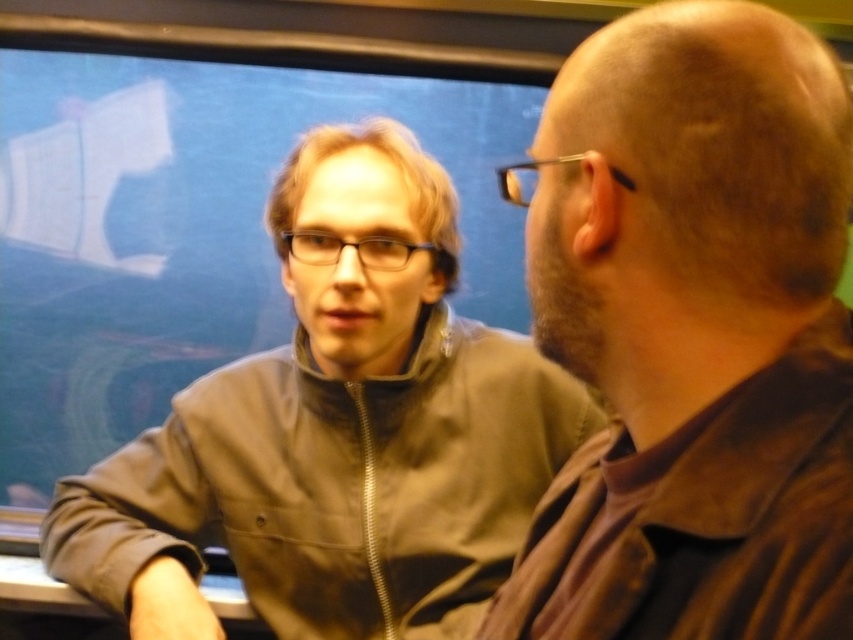
You are standing in front of the window with two points marked on it. The points are labeled as point (654, 83) and point (402, 460). Which point is nearer to you?

Point (654, 83) is closer to the camera than point (402, 460), so the point nearer to you is point (654, 83).

You are standing in the room where the two people are sitting. You want to place a small plant exactly at point (x=692, y=332). Is there enough space there to place the plant without it being under any objects?

At point (x=692, y=332) lies brown leather jacket at right, so no, there is not enough space to place the plant there as the point is occupied by the brown leather jacket at right.

You are standing in front of the image and want to locate the brown leather jacket at right. According to the coordinates provided, where exactly is it positioned?

The brown leather jacket at right is located at point 0.520 on the x axis and 0.812 on the y axis.